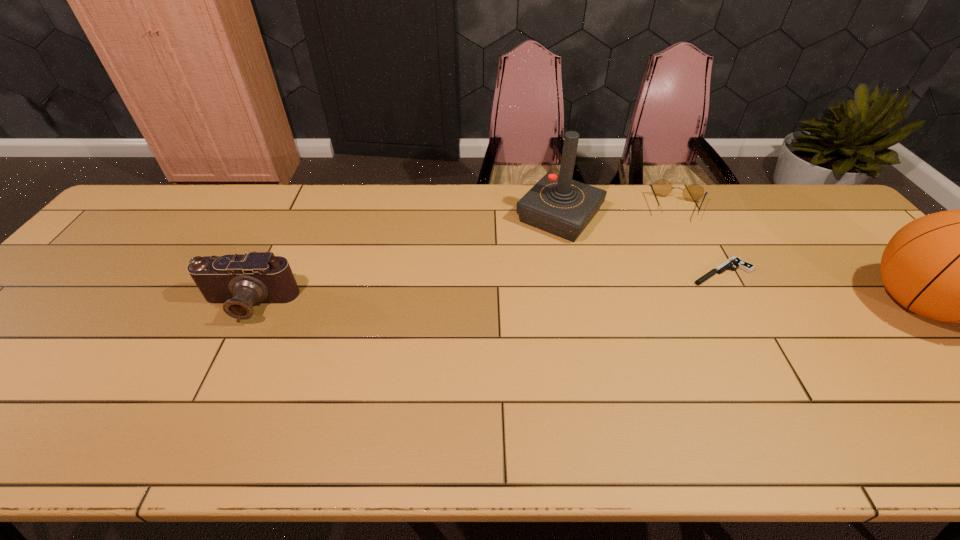
Image resolution: width=960 pixels, height=540 pixels. I want to click on the leftmost object, so click(237, 281).

Where is `camera`? Image resolution: width=960 pixels, height=540 pixels. camera is located at coordinates (237, 281).

Locate an element on the screen. Image resolution: width=960 pixels, height=540 pixels. pistol is located at coordinates (736, 262).

At what (x,y) coordinates should I click in order to perform the action: click on the fourth object from right to left. Please return your answer as a coordinate pair (x, y). This screenshot has width=960, height=540. Looking at the image, I should click on (556, 204).

Identify the location of spectacles. The image size is (960, 540). (662, 187).

This screenshot has height=540, width=960. Identify the location of free space located 0.180m on the front-facing side of the leftmost object. (204, 393).

Locate an element on the screen. The width and height of the screenshot is (960, 540). free spot located 0.180m on the front-facing side of the pistol is located at coordinates (655, 309).

Where is `vacant space located on the front-facing side of the pistol`? vacant space located on the front-facing side of the pistol is located at coordinates (622, 332).

Where is `free space located on the front-facing side of the pistol`? The width and height of the screenshot is (960, 540). free space located on the front-facing side of the pistol is located at coordinates (639, 320).

Locate an element on the screen. free space located 0.360m on the rectangular base of the joystick is located at coordinates (469, 320).